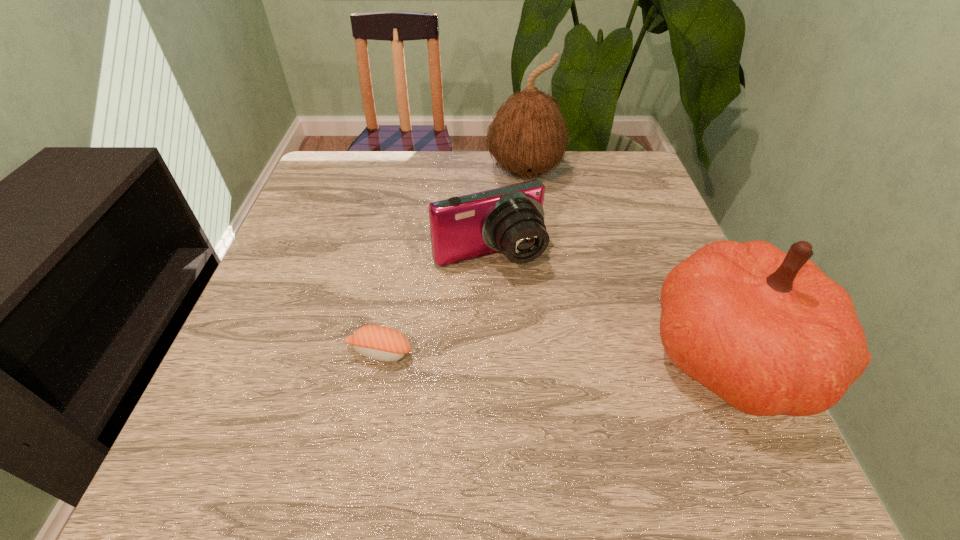
Identify the location of free spot located 0.260m on the surface of the coconut. This screenshot has height=540, width=960. (554, 265).

The height and width of the screenshot is (540, 960). Find the location of `vacant region located on the front-facing side of the camera`. vacant region located on the front-facing side of the camera is located at coordinates (571, 388).

Find the location of a particular element. This screenshot has height=540, width=960. vacant space located on the front-facing side of the camera is located at coordinates pyautogui.click(x=574, y=393).

Find the location of a particular element. The image size is (960, 540). vacant space located 0.290m on the front-facing side of the camera is located at coordinates 574,393.

You are a GUI agent. You are given a task and a screenshot of the screen. Output one action in this format:
    pyautogui.click(x=<x>, y=<y>)
    Task: Click on the object located at the far edge
    
    Given the screenshot: What is the action you would take?
    pyautogui.click(x=528, y=137)

This screenshot has height=540, width=960. I want to click on object that is at the near edge, so click(769, 332).

Where is `object present at the right edge`? The image size is (960, 540). object present at the right edge is located at coordinates (769, 332).

Where is `object present at the near right corner`? object present at the near right corner is located at coordinates (769, 332).

In the image, there is a desktop. What are the coordinates of `vacant space at the far edge` in the screenshot? It's located at (564, 172).

Image resolution: width=960 pixels, height=540 pixels. Find the location of `vacant area at the near edge`. vacant area at the near edge is located at coordinates (341, 386).